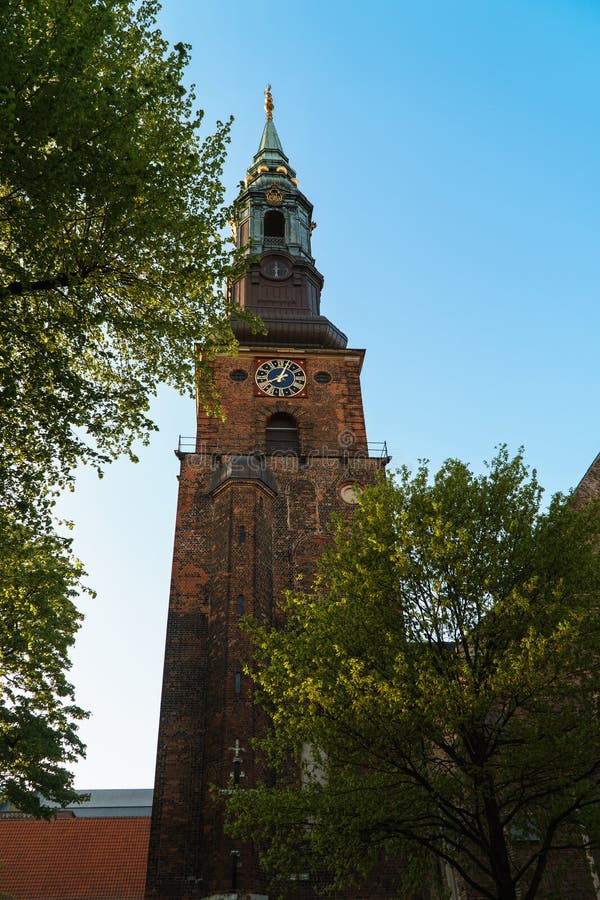
You are a GUI agent. You are given a task and a screenshot of the screen. Output one action in this format:
    pyautogui.click(x=<x>, y=<y>)
    Task: Click on the clock
    
    Given the screenshot: What is the action you would take?
    pyautogui.click(x=286, y=385)